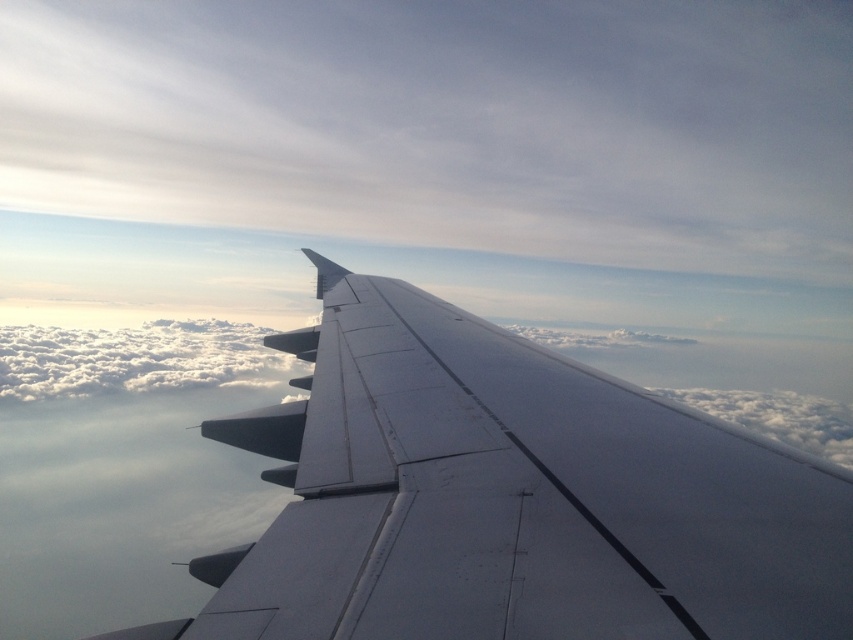
You are a passenger on an airplane and looking out the window. You see a white fluffy cloud at center and a white fluffy cloud at upper right. Which cloud appears taller from your viewpoint?

The white fluffy cloud at upper right appears taller than the white fluffy cloud at center because the white fluffy cloud at center is not as tall as white fluffy cloud at upper right.

You are a passenger sitting by the window and notice the metallic gray wing at center and the white fluffy cloud at upper right. Which object appears closer to you based on their sizes in the image?

The metallic gray wing at center appears closer to you because it is shorter than the white fluffy cloud at upper right, which is farther away and thus appears smaller.

From the picture: You are a passenger sitting by the window on an airplane. You notice the metallic gray wing at center and the white fluffy cloud at center outside. Which object appears taller from your seat?

The white fluffy cloud at center appears taller than the metallic gray wing at center because the metallic gray wing at center is not as tall as the white fluffy cloud at center.